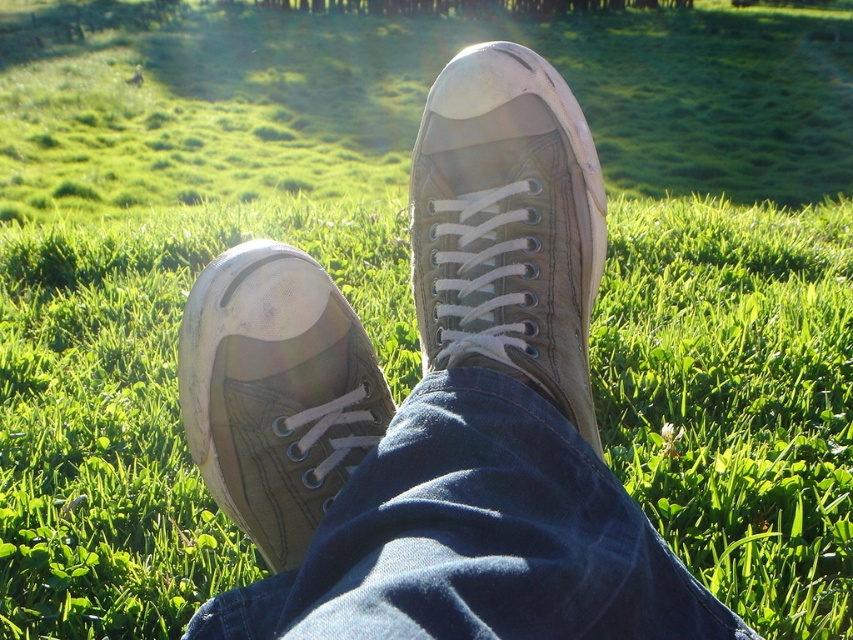
Does canvas sneakers at center appear over matte brown shoe at lower left?

No.

Who is shorter, canvas sneakers at center or matte brown shoe at lower left?

With less height is matte brown shoe at lower left.

What do you see at coordinates (434, 404) in the screenshot?
I see `canvas sneakers at center` at bounding box center [434, 404].

What are the coordinates of `canvas sneakers at center` in the screenshot? It's located at (434, 404).

Can you confirm if worn canvas shoe at center is wider than matte brown shoe at lower left?

Yes, worn canvas shoe at center is wider than matte brown shoe at lower left.

Locate an element on the screen. Image resolution: width=853 pixels, height=640 pixels. worn canvas shoe at center is located at coordinates (508, 225).

Is point (264, 616) more distant than point (584, 381)?

No, (264, 616) is closer to viewer.

Is canvas sneakers at center wider than worn canvas shoe at center?

Indeed, canvas sneakers at center has a greater width compared to worn canvas shoe at center.

Which is in front, point (466, 284) or point (440, 216)?

Point (466, 284) is more forward.

Identify the location of canvas sneakers at center. The height and width of the screenshot is (640, 853). (434, 404).